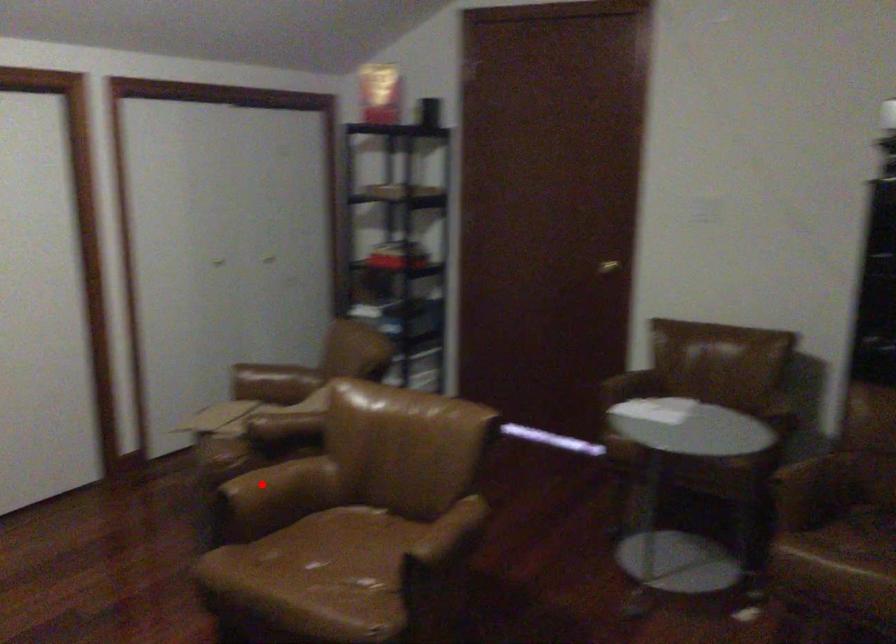
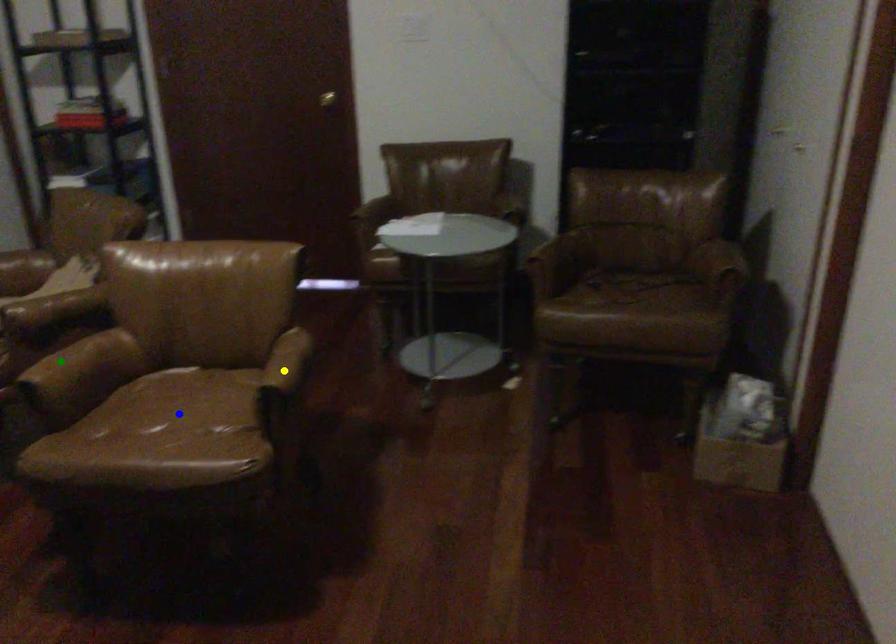
Question: I am providing you with two images of the same scene from different viewpoints. A red point is marked on the first image. You are given multiple points on the second image. Which mark in image 2 goes with the point in image 1?

Choices:
 (A) yellow point
 (B) blue point
 (C) green point

Answer: (C)